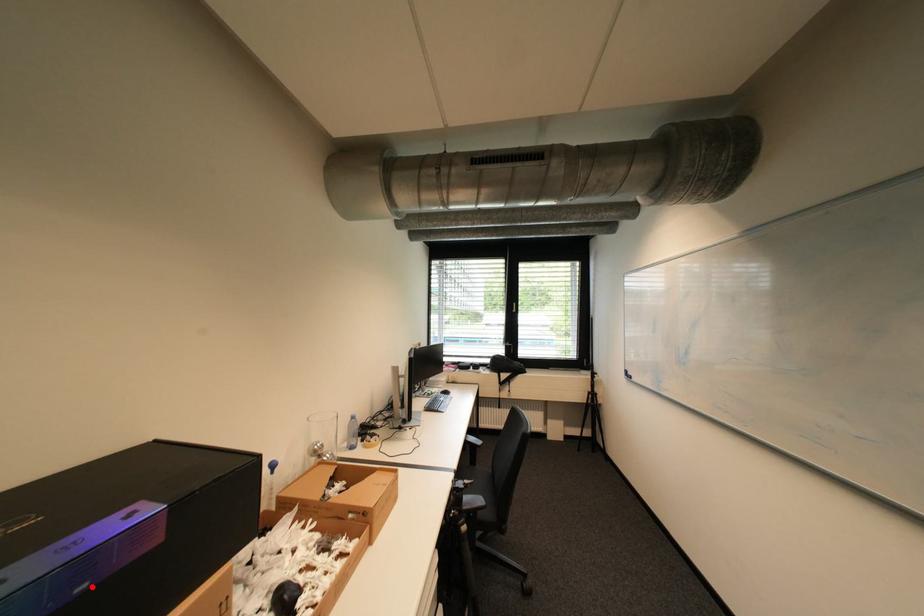
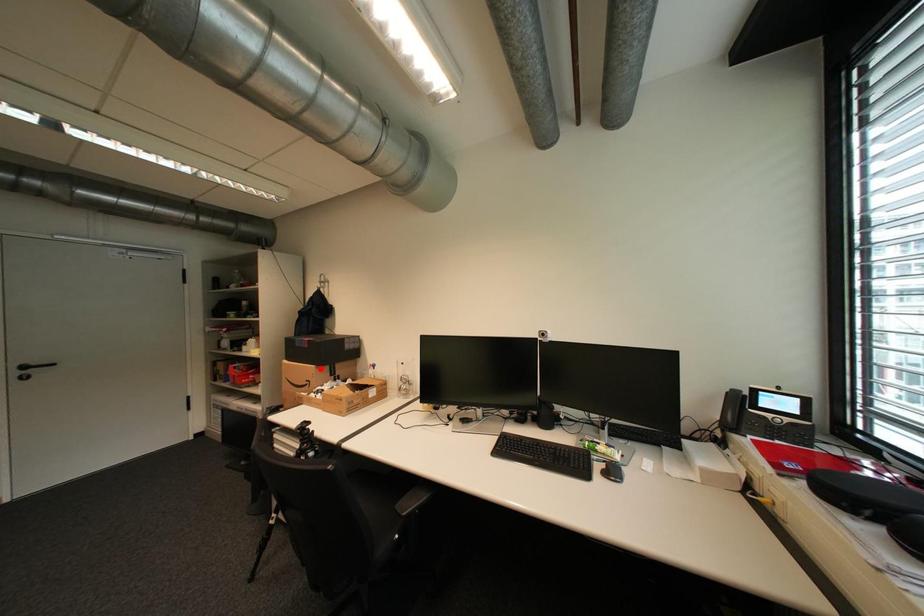
I am providing you with two images of the same scene from different viewpoints. A red point is marked on the first image and another point is marked on the second image. Are the points marked in image1 and image2 representing the same 3D position?

No